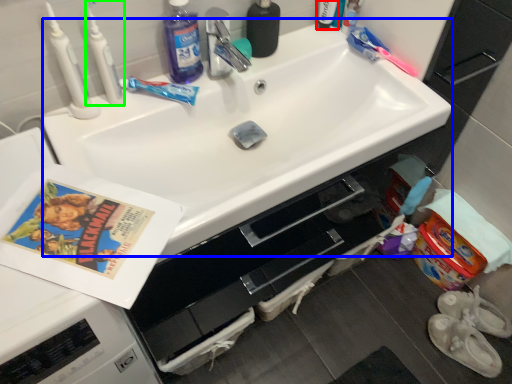
Question: Which object is positioned farthest from toiletry (highlighted by a red box)? Select from sink (highlighted by a blue box) and toothbrush (highlighted by a green box).

Choices:
 (A) sink
 (B) toothbrush

Answer: (B)